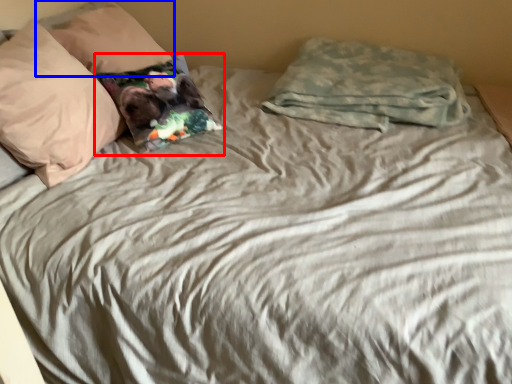
Question: Which point is further to the camera, pillow (highlighted by a red box) or pillow (highlighted by a blue box)?

Choices:
 (A) pillow
 (B) pillow

Answer: (B)